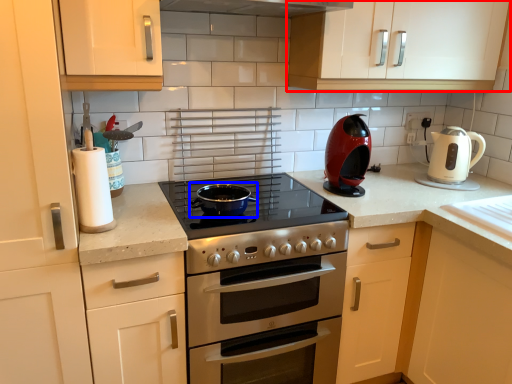
Question: Among these objects, which one is nearest to the camera, cabinetry (highlighted by a red box) or wok (highlighted by a blue box)?

Choices:
 (A) cabinetry
 (B) wok

Answer: (B)